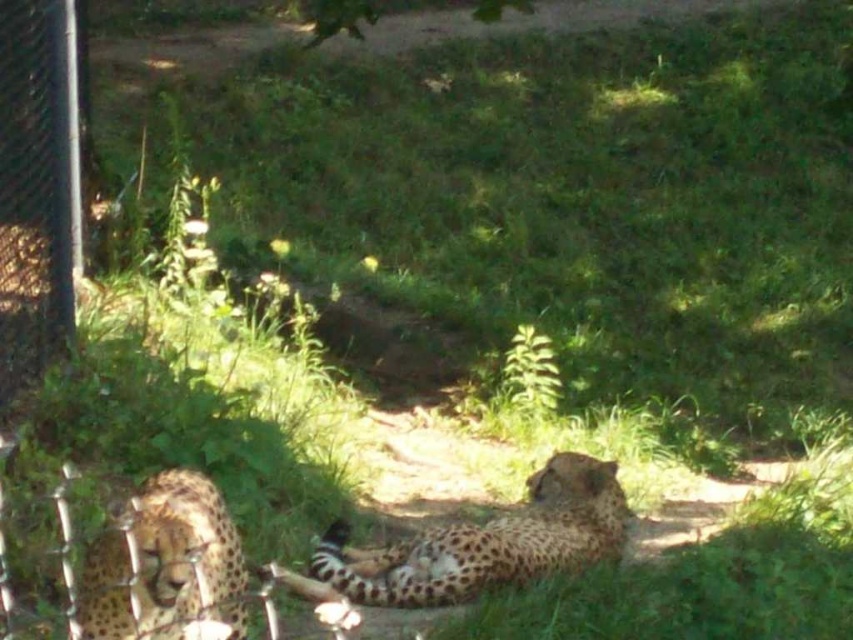
Question: Can you confirm if spotted fur cheetah at center is positioned below spotted fur cheetah at lower left?

Choices:
 (A) no
 (B) yes

Answer: (B)

Question: Can you confirm if spotted fur cheetah at center is bigger than spotted fur cheetah at lower left?

Choices:
 (A) yes
 (B) no

Answer: (A)

Question: Which of the following is the farthest from the observer?

Choices:
 (A) (193, 496)
 (B) (490, 557)

Answer: (B)

Question: Where is spotted fur cheetah at center located in relation to spotted fur cheetah at lower left in the image?

Choices:
 (A) below
 (B) above

Answer: (A)

Question: Which point is closer to the camera taking this photo?

Choices:
 (A) (555, 483)
 (B) (142, 532)

Answer: (B)

Question: Which object appears closest to the camera in this image?

Choices:
 (A) spotted fur cheetah at lower left
 (B) spotted fur cheetah at center

Answer: (A)